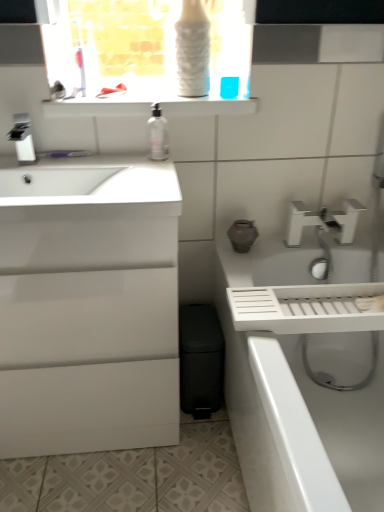
This screenshot has height=512, width=384. In order to click on vacant area that lies between clear plastic bottle at center and satin nickel faucet at upper left, the 1th tap viewed from the left in this screenshot , I will do `click(94, 160)`.